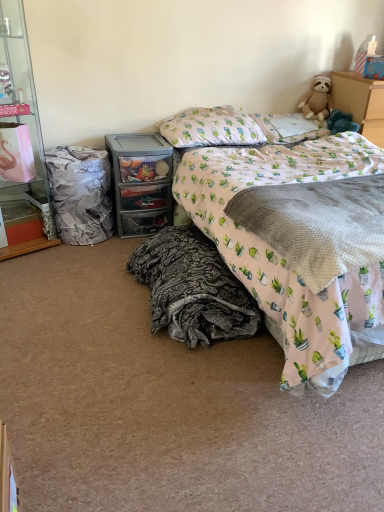
Describe the element at coordinates (317, 99) in the screenshot. I see `fluffy beige teddy bear at upper right` at that location.

What do you see at coordinates (81, 194) in the screenshot? This screenshot has width=384, height=512. I see `marble-patterned laundry basket at left` at bounding box center [81, 194].

What are the coordinates of `pink fabric bed at center` in the screenshot? It's located at (260, 239).

Locate an element on the screen. The width and height of the screenshot is (384, 512). dark gray textured blanket at lower center, the second blanket viewed from the right is located at coordinates point(193,289).

Image resolution: width=384 pixels, height=512 pixels. I want to click on clear glass cabinet at left, so (x=25, y=141).

Describe the element at coordinates (294, 127) in the screenshot. I see `cactus-patterned fabric pillow at upper right, the 2th pillow viewed from the left` at that location.

I want to click on fluffy beige teddy bear at upper right, so click(317, 99).

Can we say clear glass cabinet at left lies outside marble-patterned laundry basket at left?

Yes, clear glass cabinet at left is located beyond the bounds of marble-patterned laundry basket at left.

Is clear glass cabinet at left oriented away from marble-patterned laundry basket at left?

clear glass cabinet at left is not turned away from marble-patterned laundry basket at left.

Find the location of a particular element. This screenshot has width=384, height=512. material behind the clear glass cabinet at left is located at coordinates (81, 194).

Does clear glass cabinet at left appear on the right side of marble-patterned laundry basket at left?

No, clear glass cabinet at left is not to the right of marble-patterned laundry basket at left.

Are fluffy beige teddy bear at upper right and cactus-patterned fabric pillow at upper right, the 2th pillow viewed from the left, located far from each other?

No, fluffy beige teddy bear at upper right is not far away from cactus-patterned fabric pillow at upper right, the 2th pillow viewed from the left.

Considering the relative positions of fluffy beige teddy bear at upper right and cactus-patterned fabric pillow at upper right, the 2th pillow viewed from the left, in the image provided, is fluffy beige teddy bear at upper right behind cactus-patterned fabric pillow at upper right, the 2th pillow viewed from the left,?

Yes, fluffy beige teddy bear at upper right is further from the camera.

How different are the orientations of fluffy beige teddy bear at upper right and cactus-patterned fabric pillow at upper right, which appears as the 1th pillow when viewed from the right, in degrees?

fluffy beige teddy bear at upper right and cactus-patterned fabric pillow at upper right, which appears as the 1th pillow when viewed from the right, are facing 33.6 degrees away from each other.

From the image's perspective, is fluffy beige teddy bear at upper right below cactus-patterned fabric pillow at upper right, which appears as the 1th pillow when viewed from the right?

No.

Which of these two, gray textured blanket at center, which is the first blanket in right-to-left order, or fluffy beige teddy bear at upper right, stands taller?

Standing taller between the two is fluffy beige teddy bear at upper right.

Is gray textured blanket at center, which ranks as the 2th blanket in left-to-right order, facing towards fluffy beige teddy bear at upper right?

No, gray textured blanket at center, which ranks as the 2th blanket in left-to-right order, is not facing towards fluffy beige teddy bear at upper right.

How different are the orientations of gray textured blanket at center, which is the first blanket in right-to-left order, and fluffy beige teddy bear at upper right in degrees?

The angle between the facing direction of gray textured blanket at center, which is the first blanket in right-to-left order, and the facing direction of fluffy beige teddy bear at upper right is 35.2 degrees.

Considering the relative sizes of pillow at upper center, arranged as the 1th pillow when viewed from the left, and clear glass cabinet at left in the image provided, is pillow at upper center, arranged as the 1th pillow when viewed from the left, shorter than clear glass cabinet at left?

Indeed, pillow at upper center, arranged as the 1th pillow when viewed from the left, has a lesser height compared to clear glass cabinet at left.

Is point (211, 117) farther from camera compared to point (2, 258)?

Yes.

Could you tell me if pillow at upper center, arranged as the 1th pillow when viewed from the left, is turned towards clear glass cabinet at left?

No, pillow at upper center, arranged as the 1th pillow when viewed from the left, is not aimed at clear glass cabinet at left.

From a real-world perspective, is pillow at upper center, arranged as the 1th pillow when viewed from the left, on top of clear glass cabinet at left?

Actually, pillow at upper center, arranged as the 1th pillow when viewed from the left, is physically below clear glass cabinet at left in the real world.

Find the location of `teddy bear that appears above the dark gray textured blanket at lower center, the second blanket viewed from the right (from a real-world perspective)`. teddy bear that appears above the dark gray textured blanket at lower center, the second blanket viewed from the right (from a real-world perspective) is located at coordinates (317, 99).

How distant is dark gray textured blanket at lower center, the second blanket viewed from the right, from fluffy beige teddy bear at upper right?

dark gray textured blanket at lower center, the second blanket viewed from the right, is 5.82 feet from fluffy beige teddy bear at upper right.

Between dark gray textured blanket at lower center, which is the 1th blanket from left to right, and fluffy beige teddy bear at upper right, which one appears on the left side from the viewer's perspective?

From the viewer's perspective, dark gray textured blanket at lower center, which is the 1th blanket from left to right, appears more on the left side.

Considering the relative sizes of dark gray textured blanket at lower center, the second blanket viewed from the right, and fluffy beige teddy bear at upper right in the image provided, is dark gray textured blanket at lower center, the second blanket viewed from the right, smaller than fluffy beige teddy bear at upper right?

Actually, dark gray textured blanket at lower center, the second blanket viewed from the right, might be larger than fluffy beige teddy bear at upper right.

Between pillow at upper center, arranged as the 1th pillow when viewed from the left, and wooden chest of drawers at upper right, the 2th chest of drawers in the left-to-right sequence, which one has more height?

Standing taller between the two is wooden chest of drawers at upper right, the 2th chest of drawers in the left-to-right sequence.

From the image's perspective, is pillow at upper center, which is counted as the second pillow, starting from the right, below wooden chest of drawers at upper right, the 1th chest of drawers viewed from the right?

Indeed, from the image's perspective, pillow at upper center, which is counted as the second pillow, starting from the right, is shown beneath wooden chest of drawers at upper right, the 1th chest of drawers viewed from the right.

Considering the sizes of objects pillow at upper center, arranged as the 1th pillow when viewed from the left, and wooden chest of drawers at upper right, the 1th chest of drawers viewed from the right, in the image provided, who is smaller, pillow at upper center, arranged as the 1th pillow when viewed from the left, or wooden chest of drawers at upper right, the 1th chest of drawers viewed from the right,?

pillow at upper center, arranged as the 1th pillow when viewed from the left, is smaller.

Considering the relative positions of cactus-patterned fabric pillow at upper right, which appears as the 1th pillow when viewed from the right, and marble-patterned laundry basket at left in the image provided, is cactus-patterned fabric pillow at upper right, which appears as the 1th pillow when viewed from the right, to the right of marble-patterned laundry basket at left from the viewer's perspective?

Correct, you'll find cactus-patterned fabric pillow at upper right, which appears as the 1th pillow when viewed from the right, to the right of marble-patterned laundry basket at left.

You are a GUI agent. You are given a task and a screenshot of the screen. Output one action in this format:
    pyautogui.click(x=<x>, y=<y>)
    Task: Click on the material that appears below the cactus-patterned fabric pillow at upper right, the 2th pillow viewed from the left (from a real-world perspective)
    This screenshot has width=384, height=512.
    Given the screenshot: What is the action you would take?
    pyautogui.click(x=81, y=194)

Is cactus-patterned fabric pillow at upper right, which appears as the 1th pillow when viewed from the right, oriented towards marble-patterned laundry basket at left?

No, cactus-patterned fabric pillow at upper right, which appears as the 1th pillow when viewed from the right, is not aimed at marble-patterned laundry basket at left.

What are the coordinates of `cabinetry above the marble-patterned laundry basket at left (from the image's perspective)` in the screenshot? It's located at (25, 141).

Which pillow is the 1st one when counting from the left side of the fluffy beige teddy bear at upper right? Please provide its 2D coordinates.

[(294, 127)]

From the image, which object appears to be farther from cactus-patterned fabric pillow at upper right, which appears as the 1th pillow when viewed from the right, marble-patterned laundry basket at left or wooden chest of drawers at upper right, the 1th chest of drawers viewed from the right?

Among the two, marble-patterned laundry basket at left is located further to cactus-patterned fabric pillow at upper right, which appears as the 1th pillow when viewed from the right.

Estimate the real-world distances between objects in this image. Which object is closer to cactus-patterned fabric pillow at upper right, which appears as the 1th pillow when viewed from the right, pink fabric bed at center or wooden chest of drawers at upper right, the 1th chest of drawers viewed from the right?

Based on the image, wooden chest of drawers at upper right, the 1th chest of drawers viewed from the right, appears to be nearer to cactus-patterned fabric pillow at upper right, which appears as the 1th pillow when viewed from the right.

Considering their positions, is clear glass cabinet at left positioned further to pink fabric bed at center than fluffy beige teddy bear at upper right?

clear glass cabinet at left lies further to pink fabric bed at center than the other object.

Considering their positions, is wooden chest of drawers at upper right, the 2th chest of drawers in the left-to-right sequence, positioned closer to dark gray textured blanket at lower center, the second blanket viewed from the right, than gray textured blanket at center, which is the first blanket in right-to-left order?

gray textured blanket at center, which is the first blanket in right-to-left order.

Which object lies nearer to the anchor point cactus-patterned fabric pillow at upper right, the 2th pillow viewed from the left, gray textured blanket at center, which ranks as the 2th blanket in left-to-right order, or fluffy beige teddy bear at upper right?

The object closer to cactus-patterned fabric pillow at upper right, the 2th pillow viewed from the left, is fluffy beige teddy bear at upper right.

When comparing their distances from gray textured blanket at center, which ranks as the 2th blanket in left-to-right order, does clear plastic drawer at center, the 1th chest of drawers when ordered from left to right, or wooden chest of drawers at upper right, the 2th chest of drawers in the left-to-right sequence, seem further?

Based on the image, wooden chest of drawers at upper right, the 2th chest of drawers in the left-to-right sequence, appears to be further to gray textured blanket at center, which ranks as the 2th blanket in left-to-right order.

Considering their positions, is gray textured blanket at center, which is the first blanket in right-to-left order, positioned further to dark gray textured blanket at lower center, which is the 1th blanket from left to right, than pink fabric bed at center?

Among the two, gray textured blanket at center, which is the first blanket in right-to-left order, is located further to dark gray textured blanket at lower center, which is the 1th blanket from left to right.

When comparing their distances from dark gray textured blanket at lower center, which is the 1th blanket from left to right, does clear glass cabinet at left or pillow at upper center, arranged as the 1th pillow when viewed from the left, seem further?

clear glass cabinet at left lies further to dark gray textured blanket at lower center, which is the 1th blanket from left to right, than the other object.

This screenshot has height=512, width=384. I want to click on chest of drawers between marble-patterned laundry basket at left and pillow at upper center, which is counted as the second pillow, starting from the right, so click(x=141, y=182).

You are a GUI agent. You are given a task and a screenshot of the screen. Output one action in this format:
    pyautogui.click(x=<x>, y=<y>)
    Task: Click on the chest of drawers located between clear glass cabinet at left and pillow at upper center, arranged as the 1th pillow when viewed from the left, in the left-right direction
    The height and width of the screenshot is (512, 384).
    Given the screenshot: What is the action you would take?
    pyautogui.click(x=141, y=182)

The height and width of the screenshot is (512, 384). Identify the location of teddy bear situated between dark gray textured blanket at lower center, the second blanket viewed from the right, and wooden chest of drawers at upper right, the 1th chest of drawers viewed from the right, from left to right. (317, 99).

What are the coordinates of `the chest of drawers located between clear glass cabinet at left and cactus-patterned fabric pillow at upper right, the 2th pillow viewed from the left, in the left-right direction` in the screenshot? It's located at (141, 182).